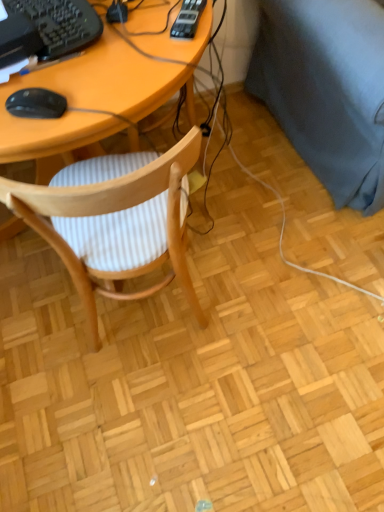
Image resolution: width=384 pixels, height=512 pixels. Identify the location of vacant area that is situated to the right of black matte mouse at left. (113, 86).